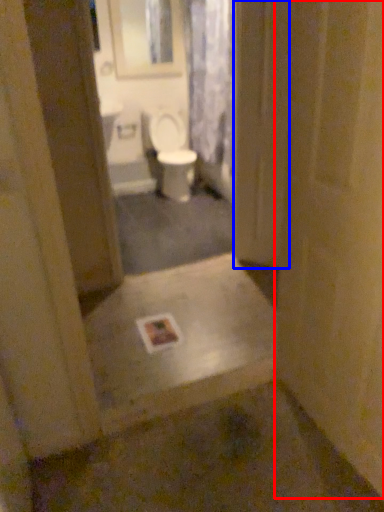
Question: Which object appears closest to the camera in this image, door (highlighted by a red box) or screen door (highlighted by a blue box)?

Choices:
 (A) door
 (B) screen door

Answer: (A)